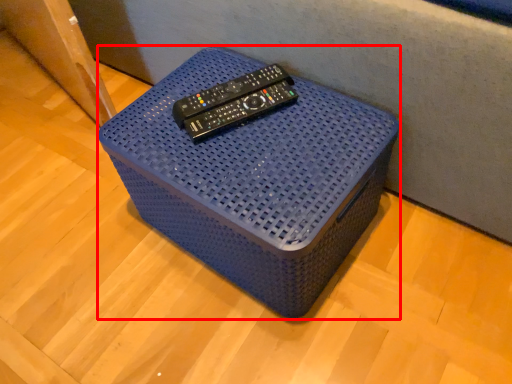
Question: In this image, where is furniture (annotated by the red box) located relative to remote?

Choices:
 (A) right
 (B) left

Answer: (A)